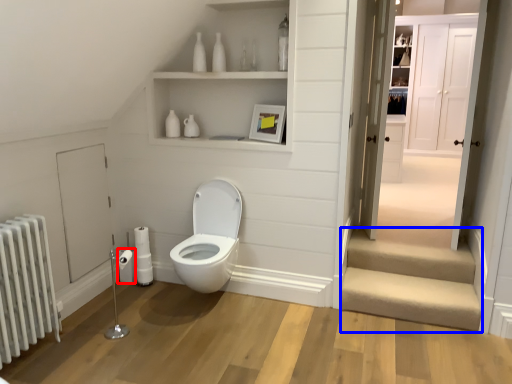
Question: Which object appears closest to the camera in this image, toilet paper (highlighted by a red box) or stairwell (highlighted by a blue box)?

Choices:
 (A) toilet paper
 (B) stairwell

Answer: (B)